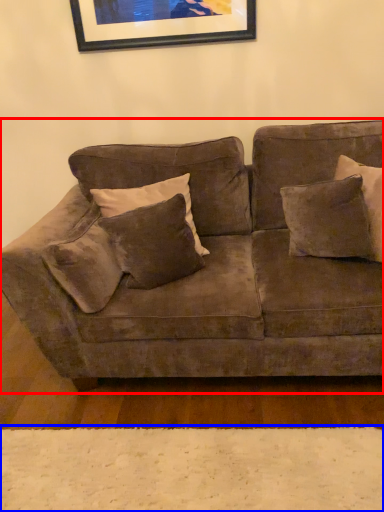
Question: Which object appears closest to the camera in this image, studio couch (highlighted by a red box) or plain (highlighted by a blue box)?

Choices:
 (A) studio couch
 (B) plain

Answer: (A)